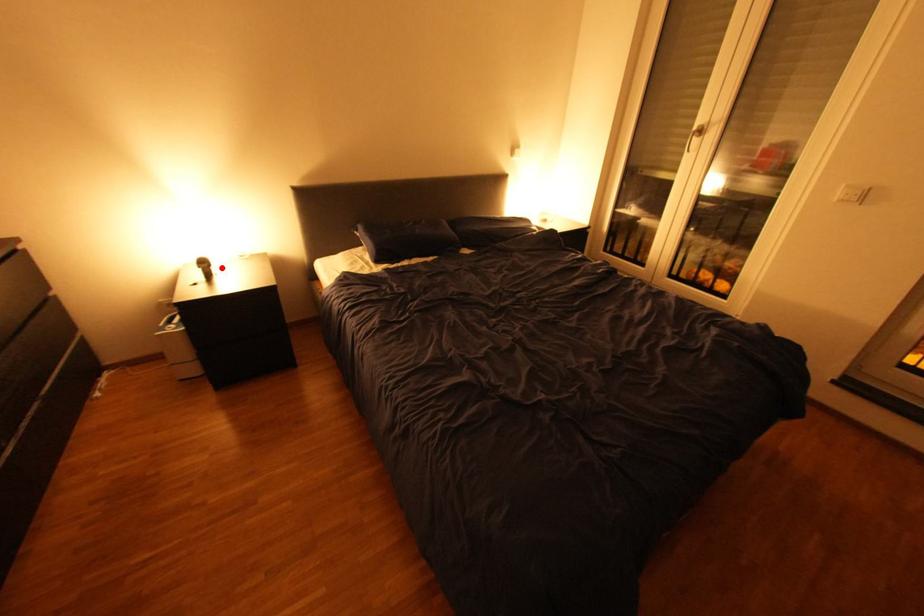
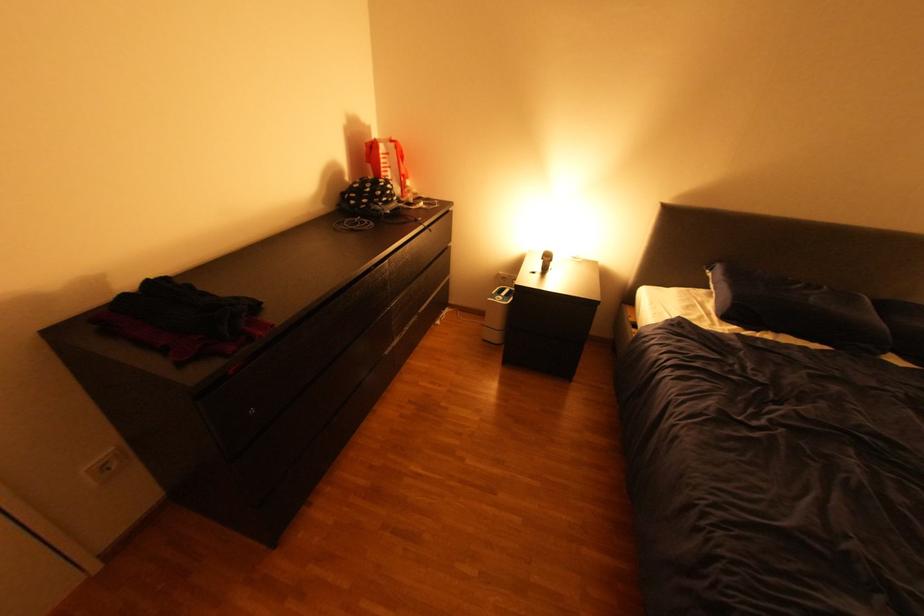
Where in the second image is the point corresponding to the highlighted location from the first image?

(561, 262)